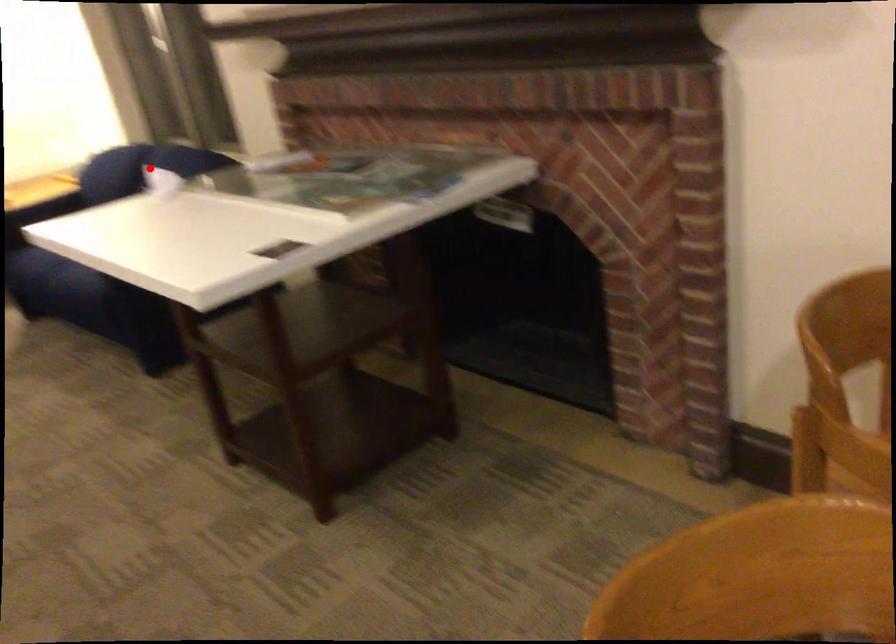
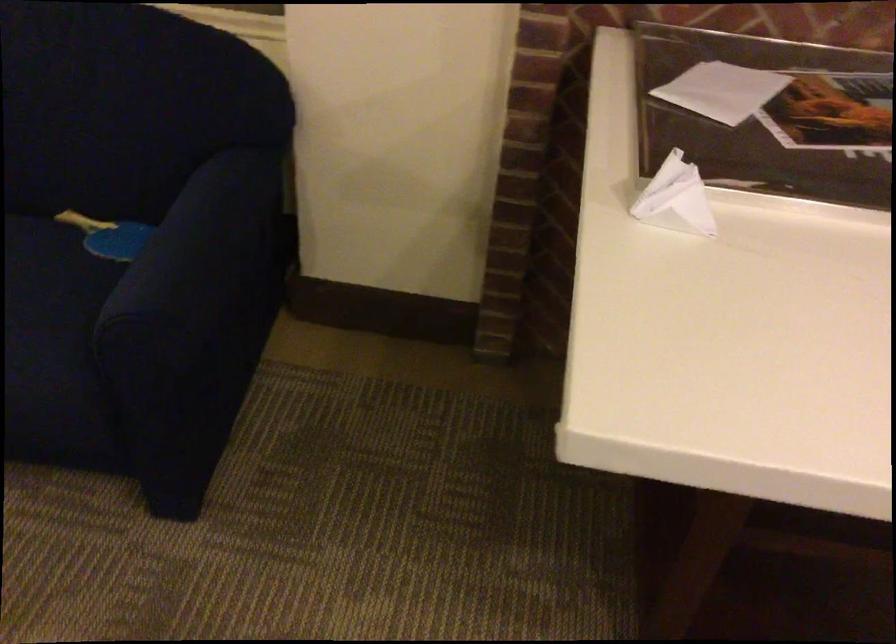
Question: I am providing you with two images of the same scene from different viewpoints. Given a red point in image1, look at the same physical point in image2. Is it:

Choices:
 (A) Closer to the viewpoint
 (B) Farther from the viewpoint

Answer: (A)